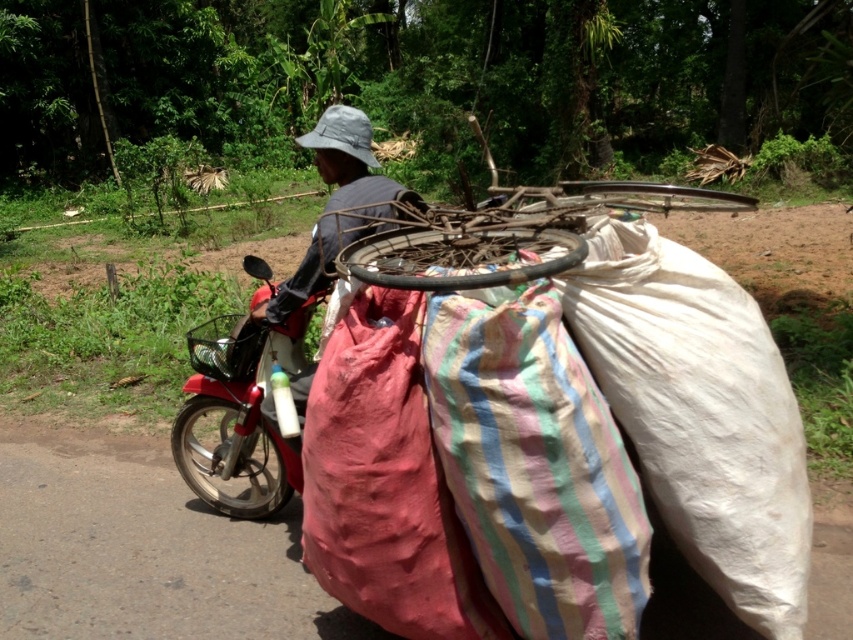
You are a delivery person who needs to know if the wooden bicycle wheel at center can be placed under the camouflage fabric hat at upper center without touching it. Based on their sizes, can you confirm if this is possible?

The wooden bicycle wheel at center is taller than the camouflage fabric hat at upper center, so placing it under the hat would require the wheel to be lowered or the hat to be raised to avoid contact.

You are a photographer taking a picture of the motorbike rider. You notice two points in the scene at coordinates point (248,483) and point (361,216). Which point will appear closer to the edge of the photo if the photo frame is centered on the rider?

Point (361,216) will appear closer to the edge of the photo because it is closer to the camera than point (248,483), which is further away.

You are a delivery person trying to secure a package on the wooden bicycle wheel at center. You have a camouflage fabric hat at upper center that you want to place on top of the wheel. Will the hat fit entirely on the wheel without overhanging?

The wooden bicycle wheel at center is wider than the camouflage fabric hat at upper center, so the hat will fit entirely on the wheel without overhanging.